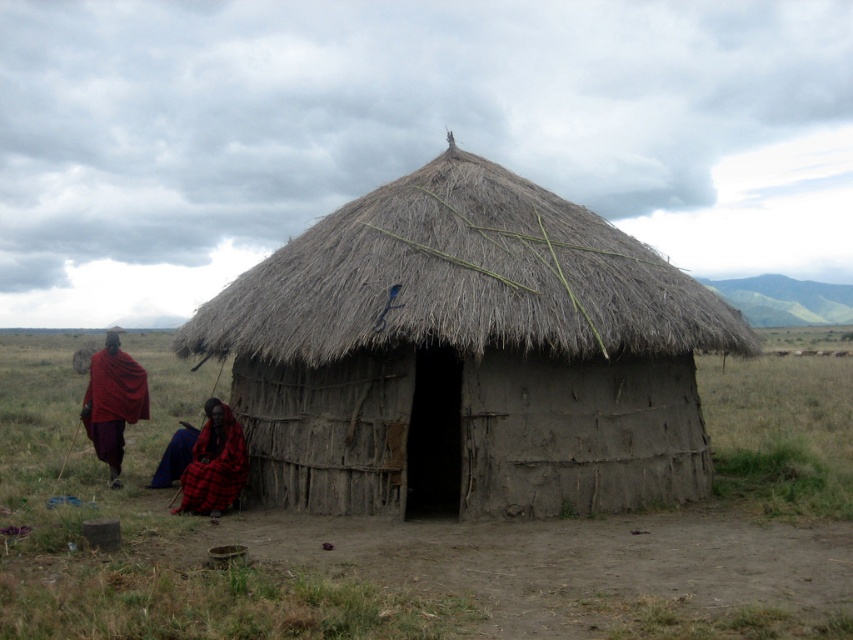
Which of these two, thatched mud hut at center or red plaid shawl at left, stands shorter?

red plaid shawl at left is shorter.

Does thatched mud hut at center lie behind red plaid shawl at left?

No, thatched mud hut at center is closer to the viewer.

Who is more forward, (448, 376) or (111, 371)?

Point (111, 371) is in front.

You are a GUI agent. You are given a task and a screenshot of the screen. Output one action in this format:
    pyautogui.click(x=<x>, y=<y>)
    Task: Click on the thatched mud hut at center
    
    Given the screenshot: What is the action you would take?
    [467, 355]

Is thatched mud hut at center smaller than green grassland at center?

Indeed, thatched mud hut at center has a smaller size compared to green grassland at center.

Does thatched mud hut at center appear on the right side of green grassland at center?

Correct, you'll find thatched mud hut at center to the right of green grassland at center.

Between point (363, 257) and point (728, 614), which one is positioned behind?

Point (363, 257)

Locate an element on the screen. thatched mud hut at center is located at coordinates (467, 355).

Does thatched mud hut at center come in front of red plaid cloth at center?

Yes, it is in front of red plaid cloth at center.

Where is `thatched mud hut at center`? thatched mud hut at center is located at coordinates (467, 355).